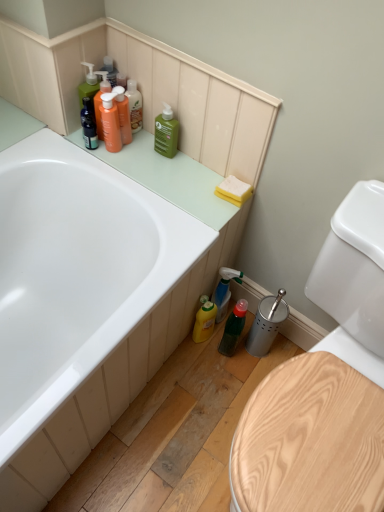
Question: Could you tell me if green matte bottle at upper center, the 3th cleaning product positioned from the bottom, is facing wooden toilet seat at lower right?

Choices:
 (A) yes
 (B) no

Answer: (B)

Question: Is the depth of green matte bottle at upper center, which ranks as the third cleaning product in right-to-left order, less than that of wooden toilet seat at lower right?

Choices:
 (A) yes
 (B) no

Answer: (B)

Question: From a real-world perspective, is green matte bottle at upper center, the 3th cleaning product positioned from the bottom, below wooden toilet seat at lower right?

Choices:
 (A) no
 (B) yes

Answer: (A)

Question: Are green matte bottle at upper center, the second cleaning product in the left-to-right sequence, and wooden toilet seat at lower right making contact?

Choices:
 (A) no
 (B) yes

Answer: (A)

Question: Is green matte bottle at upper center, the second cleaning product in the left-to-right sequence, looking in the opposite direction of wooden toilet seat at lower right?

Choices:
 (A) no
 (B) yes

Answer: (A)

Question: Is green matte bottle at upper center, the 3th cleaning product positioned from the bottom, taller or shorter than yellow sponge at upper right?

Choices:
 (A) tall
 (B) short

Answer: (A)

Question: Does point (175, 143) appear closer or farther from the camera than point (251, 186)?

Choices:
 (A) farther
 (B) closer

Answer: (A)

Question: Relative to yellow sponge at upper right, is green matte bottle at upper center, the second cleaning product in the left-to-right sequence, in front or behind?

Choices:
 (A) front
 (B) behind

Answer: (B)

Question: From the image's perspective, is green matte bottle at upper center, the second cleaning product in the left-to-right sequence, positioned above or below yellow sponge at upper right?

Choices:
 (A) below
 (B) above

Answer: (B)

Question: Is green matte bottle at lower center wider or thinner than white glossy bathtub at upper left?

Choices:
 (A) wide
 (B) thin

Answer: (B)

Question: Is point (226, 331) positioned closer to the camera than point (6, 240)?

Choices:
 (A) farther
 (B) closer

Answer: (A)

Question: Based on their positions, is green matte bottle at lower center located to the left or right of white glossy bathtub at upper left?

Choices:
 (A) right
 (B) left

Answer: (A)

Question: Relative to white glossy bathtub at upper left, is green matte bottle at lower center in front or behind?

Choices:
 (A) front
 (B) behind

Answer: (B)

Question: Is translucent green spray bottle at lower right, the first cleaning product in the right-to-left sequence, situated inside green matte bottle at upper center, which appears as the 2th cleaning product when viewed from the top, or outside?

Choices:
 (A) inside
 (B) outside

Answer: (B)

Question: From a real-world perspective, relative to green matte bottle at upper center, which ranks as the third cleaning product in right-to-left order, is translucent green spray bottle at lower right, arranged as the third cleaning product when viewed from the top, vertically above or below?

Choices:
 (A) above
 (B) below

Answer: (B)